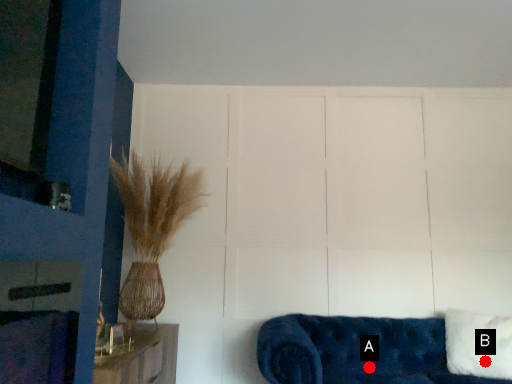
Question: Two points are circled on the image, labeled by A and B beside each circle. Which of the following is the farthest from the observer?

Choices:
 (A) A is further
 (B) B is further

Answer: (A)